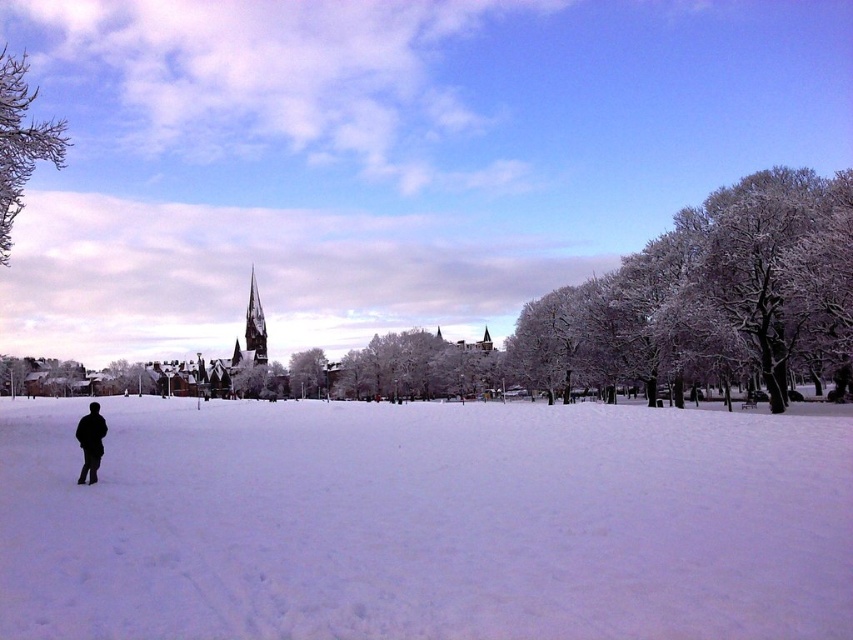
In the scene shown: You are an artist trying to sketch the winter scene. You notice the frosty white branches at upper left. Where exactly should you place them on your canvas to match the original image?

The frosty white branches at upper left should be placed at coordinates point (21,141) to accurately reflect their position in the original scene.

You are a photographer wanting to capture the frosty white branches at upper left and dark brown wooden spire at center in the same frame. Which object will appear larger in the photo?

The frosty white branches at upper left will appear larger in the photo because they are much taller than the dark brown wooden spire at center.